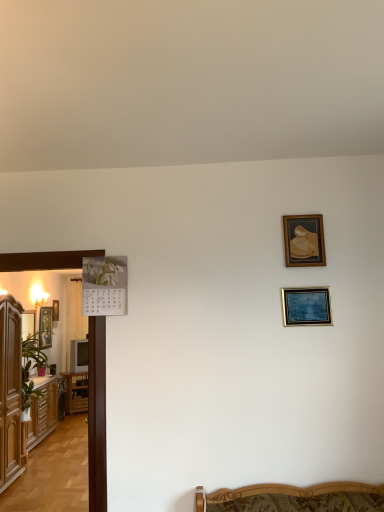
Question: From their relative heights in the image, would you say brown wood cabinet at left, acting as the 1th cabinetry starting from the front, is taller or shorter than wooden cabinet at left, which is the second cabinetry in front-to-back order?

Choices:
 (A) tall
 (B) short

Answer: (A)

Question: Is brown wood cabinet at left, acting as the 1th cabinetry starting from the front, to the left or to the right of wooden cabinet at left, which is the second cabinetry in front-to-back order, in the image?

Choices:
 (A) right
 (B) left

Answer: (A)

Question: Based on their relative distances, which object is nearer to the gold-framed picture at upper right, which is the first picture frame from right to left?

Choices:
 (A) gold-framed portrait at left, marked as the third picture frame in a right-to-left arrangement
 (B) wooden cabinet at left, which is the 1th cabinetry in back-to-front order
 (C) brown wood cabinet at left, acting as the 1th cabinetry starting from the front
 (D) brown wooden table at left
 (E) metallic silver picture frame at center right, the 2th picture frame positioned from the right

Answer: (E)

Question: Estimate the real-world distances between objects in this image. Which object is farther from the gold-framed picture at left, which is the 1th picture frame in left-to-right order?

Choices:
 (A) gold-framed portrait at left, marked as the third picture frame in a right-to-left arrangement
 (B) matte wooden picture frame at left, which is the 3th picture frame in front-to-back order
 (C) metallic silver picture frame at center right, which is counted as the 5th picture frame, starting from the back
 (D) wooden cabinet at left, which is the second cabinetry in front-to-back order
 (E) gold-framed picture at upper right, the second picture frame when ordered from front to back

Answer: (E)